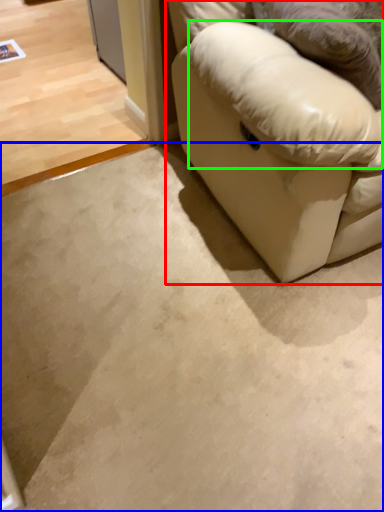
Question: Which object is positioned closest to studio couch (highlighted by a red box)? Select from concrete (highlighted by a blue box) and pillow (highlighted by a green box).

Choices:
 (A) concrete
 (B) pillow

Answer: (B)